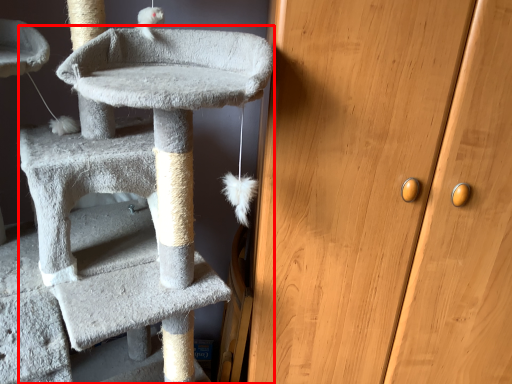
Question: From the image's perspective, where is cat furniture (annotated by the red box) located relative to door?

Choices:
 (A) above
 (B) below

Answer: (B)